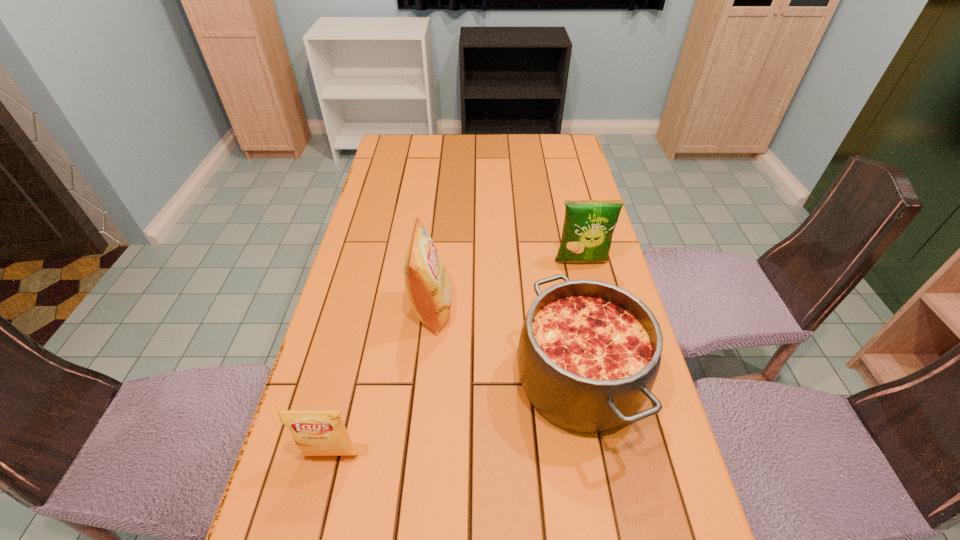
I want to click on the second crisp (potato chip) from right to left, so click(x=429, y=287).

I want to click on the second farthest crisp (potato chip), so click(429, 287).

The image size is (960, 540). In order to click on the rightmost crisp (potato chip) in this screenshot , I will do `click(588, 227)`.

The width and height of the screenshot is (960, 540). Find the location of `the farthest object`. the farthest object is located at coordinates (588, 227).

You are a GUI agent. You are given a task and a screenshot of the screen. Output one action in this format:
    pyautogui.click(x=<x>, y=<y>)
    Task: Click on the casserole
    
    Given the screenshot: What is the action you would take?
    pyautogui.click(x=589, y=352)

Image resolution: width=960 pixels, height=540 pixels. I want to click on the leftmost crisp (potato chip), so (316, 432).

Locate an element on the screen. the nearest crisp (potato chip) is located at coordinates (316, 432).

At what (x,y) coordinates should I click in order to perform the action: click on free space located 0.240m on the front-facing side of the second crisp (potato chip) from right to left. Please return your answer as a coordinate pair (x, y). This screenshot has height=540, width=960. Looking at the image, I should click on (544, 309).

The image size is (960, 540). I want to click on free point located 0.210m on the front-facing side of the farthest crisp (potato chip), so click(596, 327).

Identify the location of free spot located 0.120m on the back of the casserole. (562, 285).